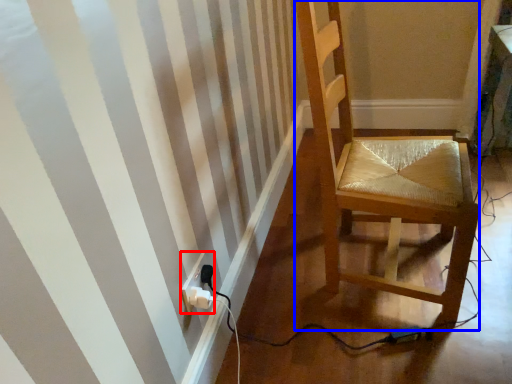
Question: Which object appears closest to the camera in this image, electric outlet (highlighted by a red box) or chair (highlighted by a blue box)?

Choices:
 (A) electric outlet
 (B) chair

Answer: (B)